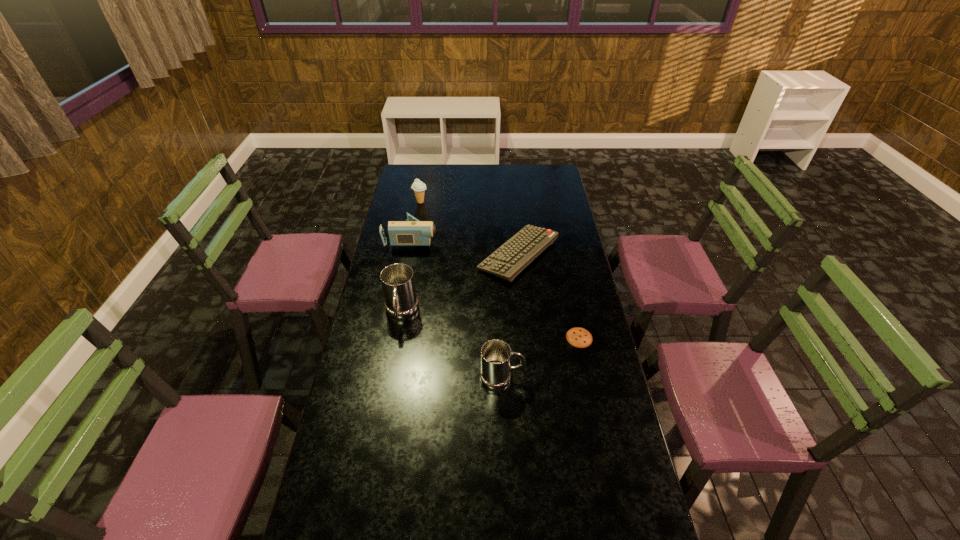
Identify the location of free region at the left edge. This screenshot has width=960, height=540. (418, 214).

In the image, there is a desktop. What are the coordinates of `vacant space at the right edge` in the screenshot? It's located at (546, 261).

Find the location of a particular element. vacant space at the far left corner of the desktop is located at coordinates (429, 167).

The width and height of the screenshot is (960, 540). I want to click on free space at the far right corner of the desktop, so click(x=551, y=165).

Where is `vacant point located between the nearer mug and the fifth tallest object`? This screenshot has width=960, height=540. vacant point located between the nearer mug and the fifth tallest object is located at coordinates (510, 316).

The height and width of the screenshot is (540, 960). Find the location of `unoccupied position between the nearest object and the camcorder`. unoccupied position between the nearest object and the camcorder is located at coordinates (457, 308).

Where is `free space between the tallest object and the icecream`? free space between the tallest object and the icecream is located at coordinates (411, 258).

At what (x,y) coordinates should I click in order to perform the action: click on unoccupied area between the shortest object and the camcorder. Please return your answer as a coordinate pair (x, y). Looking at the image, I should click on (495, 288).

Identify the location of empty space that is in between the camcorder and the second shortest object. Image resolution: width=960 pixels, height=540 pixels. (466, 247).

Where is `free space between the cookie and the right mug`? This screenshot has height=540, width=960. free space between the cookie and the right mug is located at coordinates [540, 357].